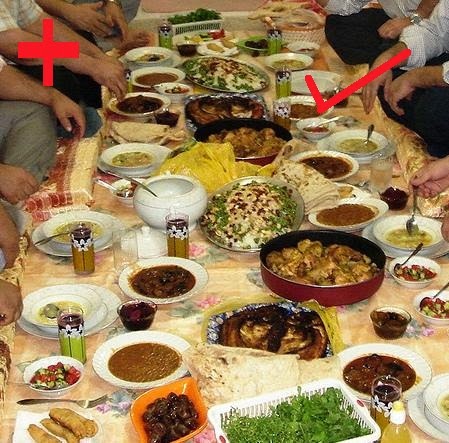
Locate an element on the screen. The image size is (449, 443). oval silver serving platter is located at coordinates point(299,217), point(254,68).